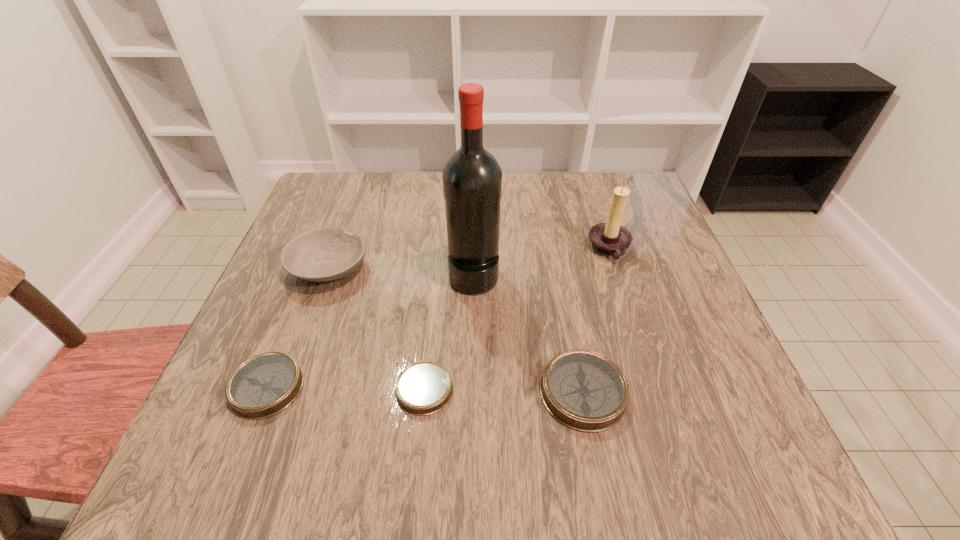
This screenshot has width=960, height=540. In order to click on vacant region located 0.100m on the right of the leftmost compass in this screenshot , I will do `click(360, 387)`.

The width and height of the screenshot is (960, 540). I want to click on blank area located 0.090m on the left of the second compass from left to right, so click(x=345, y=390).

Identify the location of vacant region located 0.260m on the left of the rightmost compass. (391, 392).

Identify the location of free spot located 0.210m on the back of the tallest object. This screenshot has height=540, width=960. (475, 204).

Identify the location of free space located on the wick of the fifth shortest object. (546, 249).

Where is `free location located 0.390m on the wick of the fifth shortest object`? The height and width of the screenshot is (540, 960). free location located 0.390m on the wick of the fifth shortest object is located at coordinates (423, 249).

At what (x,y) coordinates should I click in order to perform the action: click on blank space located on the wick of the fifth shortest object. Please return your answer as a coordinate pair (x, y). Looking at the image, I should click on (487, 249).

This screenshot has width=960, height=540. Find the location of `free region located on the back of the fourth shortest object`. free region located on the back of the fourth shortest object is located at coordinates (351, 207).

In order to click on compass at the left edge in this screenshot , I will do `click(264, 385)`.

Identify the location of bowl that is at the left edge. This screenshot has height=540, width=960. (328, 253).